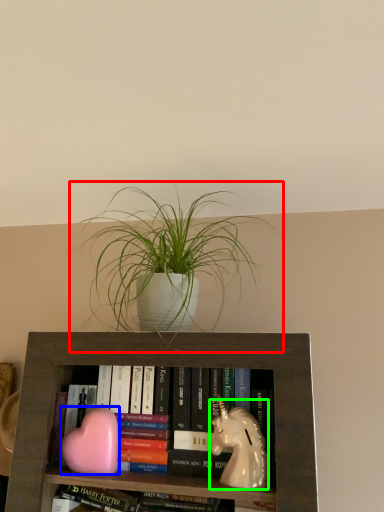
Question: Which object is the closest to the houseplant (highlighted by a red box)? Choose among these: animal (highlighted by a blue box) or animal (highlighted by a green box).

Choices:
 (A) animal
 (B) animal

Answer: (B)